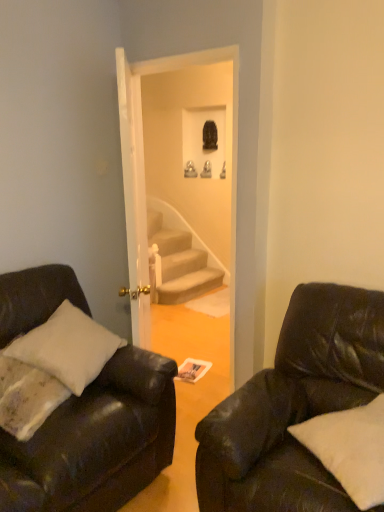
This screenshot has width=384, height=512. I want to click on black leather couch at right, acting as the 2th studio couch starting from the left, so click(293, 406).

You are a GUI agent. You are given a task and a screenshot of the screen. Output one action in this format:
    pyautogui.click(x=<x>, y=<y>)
    Task: Click on the white soft pillow at lower right
    
    Given the screenshot: What is the action you would take?
    pyautogui.click(x=350, y=449)

Is white soft pillow at lower right facing away from black leather couch at right, acting as the 2th studio couch starting from the left?

Yes.

Consider the image. Who is more distant, white soft pillow at lower right or black leather couch at right, acting as the 2th studio couch starting from the left?

white soft pillow at lower right is more distant.

From a real-world perspective, who is located higher, white soft pillow at lower right or black leather couch at right, acting as the 2th studio couch starting from the left?

From a 3D spatial view, white soft pillow at lower right is above.

Is white soft pillow at lower right next to black leather couch at right, the first studio couch from the right, and touching it?

No.

Which of these two, white soft pillow at lower right or matte black couch at left, the 2th studio couch when ordered from right to left, is bigger?

matte black couch at left, the 2th studio couch when ordered from right to left.

Between white soft pillow at lower right and matte black couch at left, the 2th studio couch when ordered from right to left, which one has more height?

matte black couch at left, the 2th studio couch when ordered from right to left.

From the image's perspective, does white soft pillow at lower right appear lower than matte black couch at left, the 2th studio couch when ordered from right to left?

Yes, from the image's perspective, white soft pillow at lower right is below matte black couch at left, the 2th studio couch when ordered from right to left.

How much distance is there between black leather couch at right, acting as the 2th studio couch starting from the left, and white soft pillow at lower right?

black leather couch at right, acting as the 2th studio couch starting from the left, and white soft pillow at lower right are 7.00 inches apart from each other.

Is white soft pillow at lower right at the back of black leather couch at right, acting as the 2th studio couch starting from the left?

No.

Who is more distant, black leather couch at right, acting as the 2th studio couch starting from the left, or white soft pillow at lower right?

white soft pillow at lower right is behind.

From a real-world perspective, is black leather couch at right, the first studio couch from the right, physically above white soft pillow at lower right?

No, from a real-world perspective, black leather couch at right, the first studio couch from the right, is not above white soft pillow at lower right.

Is matte black couch at left, the 1th studio couch from the left, shorter than white soft pillow at lower right?

In fact, matte black couch at left, the 1th studio couch from the left, may be taller than white soft pillow at lower right.

Choose the correct answer: Is matte black couch at left, the 1th studio couch from the left, inside white soft pillow at lower right or outside it?

matte black couch at left, the 1th studio couch from the left, is spatially situated outside white soft pillow at lower right.

Which object is positioned more to the right, matte black couch at left, the 2th studio couch when ordered from right to left, or white soft pillow at lower right?

white soft pillow at lower right is more to the right.

Could you tell me if matte black couch at left, the 1th studio couch from the left, is turned towards white soft pillow at lower right?

Yes, matte black couch at left, the 1th studio couch from the left, is oriented towards white soft pillow at lower right.

From a real-world perspective, is black leather couch at right, acting as the 2th studio couch starting from the left, positioned above or below matte black couch at left, the 2th studio couch when ordered from right to left?

From a real-world perspective, black leather couch at right, acting as the 2th studio couch starting from the left, is physically below matte black couch at left, the 2th studio couch when ordered from right to left.

Where is `studio couch that appears below the matte black couch at left, the 2th studio couch when ordered from right to left (from the image's perspective)`? studio couch that appears below the matte black couch at left, the 2th studio couch when ordered from right to left (from the image's perspective) is located at coordinates (293, 406).

Measure the distance between black leather couch at right, the first studio couch from the right, and matte black couch at left, the 1th studio couch from the left.

black leather couch at right, the first studio couch from the right, is 21.99 inches away from matte black couch at left, the 1th studio couch from the left.

Consider the image. Can you tell me how much black leather couch at right, acting as the 2th studio couch starting from the left, and matte black couch at left, the 1th studio couch from the left, differ in facing direction?

The angular difference between black leather couch at right, acting as the 2th studio couch starting from the left, and matte black couch at left, the 1th studio couch from the left, is 91.3 degrees.

Does matte black couch at left, the 1th studio couch from the left, have a lesser height compared to black leather couch at right, acting as the 2th studio couch starting from the left?

No, matte black couch at left, the 1th studio couch from the left, is not shorter than black leather couch at right, acting as the 2th studio couch starting from the left.

Would you say black leather couch at right, the first studio couch from the right, is part of matte black couch at left, the 1th studio couch from the left,'s contents?

No, black leather couch at right, the first studio couch from the right, is not surrounded by matte black couch at left, the 1th studio couch from the left.

Which object is wider, matte black couch at left, the 1th studio couch from the left, or black leather couch at right, the first studio couch from the right?

With larger width is black leather couch at right, the first studio couch from the right.

Which of these two, matte black couch at left, the 1th studio couch from the left, or black leather couch at right, acting as the 2th studio couch starting from the left, is bigger?

matte black couch at left, the 1th studio couch from the left, is bigger.

Locate an element on the screen. The width and height of the screenshot is (384, 512). pillow lying on the right of black leather couch at right, acting as the 2th studio couch starting from the left is located at coordinates (350, 449).

Locate an element on the screen. The image size is (384, 512). the 2nd studio couch counting from the left side of the white soft pillow at lower right is located at coordinates (96, 441).

Looking at the image, which one is located further to white soft pillow at lower right, matte black couch at left, the 2th studio couch when ordered from right to left, or black leather couch at right, acting as the 2th studio couch starting from the left?

matte black couch at left, the 2th studio couch when ordered from right to left.

Considering their positions, is matte black couch at left, the 1th studio couch from the left, positioned closer to black leather couch at right, the first studio couch from the right, than white soft pillow at lower right?

white soft pillow at lower right is closer to black leather couch at right, the first studio couch from the right.

Based on their spatial positions, is black leather couch at right, acting as the 2th studio couch starting from the left, or matte black couch at left, the 1th studio couch from the left, further from white soft pillow at lower right?

The object further to white soft pillow at lower right is matte black couch at left, the 1th studio couch from the left.

Considering their positions, is black leather couch at right, acting as the 2th studio couch starting from the left, positioned closer to matte black couch at left, the 1th studio couch from the left, than white soft pillow at lower right?

The object closer to matte black couch at left, the 1th studio couch from the left, is black leather couch at right, acting as the 2th studio couch starting from the left.

Based on their spatial positions, is white soft pillow at lower right or matte black couch at left, the 2th studio couch when ordered from right to left, closer to black leather couch at right, acting as the 2th studio couch starting from the left?

white soft pillow at lower right is positioned closer to the anchor black leather couch at right, acting as the 2th studio couch starting from the left.

Consider the image. Considering their positions, is white soft pillow at lower right positioned further to matte black couch at left, the 1th studio couch from the left, than black leather couch at right, acting as the 2th studio couch starting from the left?

white soft pillow at lower right lies further to matte black couch at left, the 1th studio couch from the left, than the other object.

The width and height of the screenshot is (384, 512). Find the location of `studio couch located between matte black couch at left, the 2th studio couch when ordered from right to left, and white soft pillow at lower right in the left-right direction`. studio couch located between matte black couch at left, the 2th studio couch when ordered from right to left, and white soft pillow at lower right in the left-right direction is located at coordinates (293, 406).